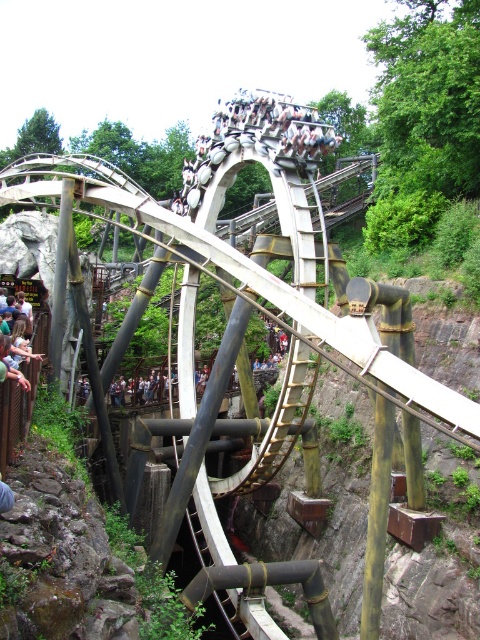
Question: Which of the following is the farthest from the observer?

Choices:
 (A) (210, 168)
 (B) (6, 364)

Answer: (A)

Question: Is metallic silver roller coaster at center above light brown wooden sign at lower left?

Choices:
 (A) no
 (B) yes

Answer: (B)

Question: Is metallic silver roller coaster at center positioned in front of light brown wooden sign at lower left?

Choices:
 (A) yes
 (B) no

Answer: (B)

Question: Can you confirm if metallic silver roller coaster at center is positioned below light brown wooden sign at lower left?

Choices:
 (A) no
 (B) yes

Answer: (A)

Question: Which object appears farthest from the camera in this image?

Choices:
 (A) light brown wooden sign at lower left
 (B) metallic silver roller coaster at center

Answer: (B)